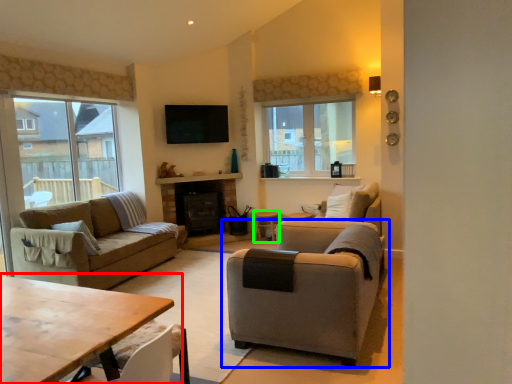
Question: Based on their relative distances, which object is nearer to table (highlighted by a red box)? Choose from chair (highlighted by a blue box) and side table (highlighted by a green box).

Choices:
 (A) chair
 (B) side table

Answer: (A)